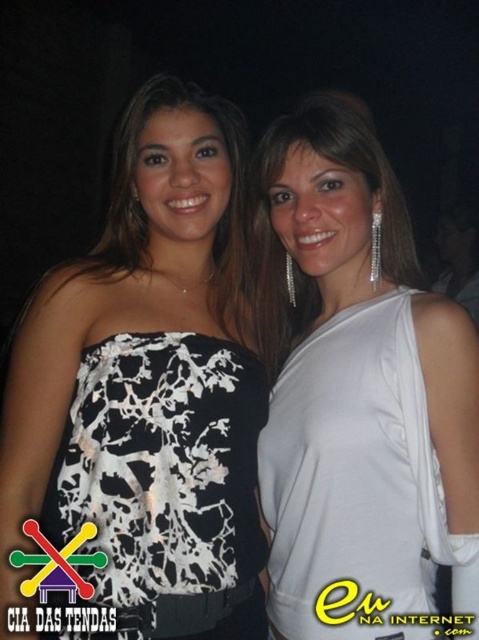
Question: Which object is the farthest from the white satin dress at center?

Choices:
 (A) white printed dress at left
 (B) white printed fabric dress at left

Answer: (B)

Question: Based on their relative distances, which object is nearer to the white printed dress at center?

Choices:
 (A) white satin dress at center
 (B) white printed dress at left
 (C) white printed fabric dress at left

Answer: (C)

Question: Does white printed dress at center have a smaller size compared to white printed dress at left?

Choices:
 (A) no
 (B) yes

Answer: (A)

Question: In this image, where is white satin dress at center located relative to white printed fabric dress at left?

Choices:
 (A) below
 (B) above

Answer: (B)

Question: Does white satin dress at center have a larger size compared to white printed dress at left?

Choices:
 (A) yes
 (B) no

Answer: (A)

Question: Which point is closer to the camera?

Choices:
 (A) white printed fabric dress at left
 (B) white printed dress at left

Answer: (A)